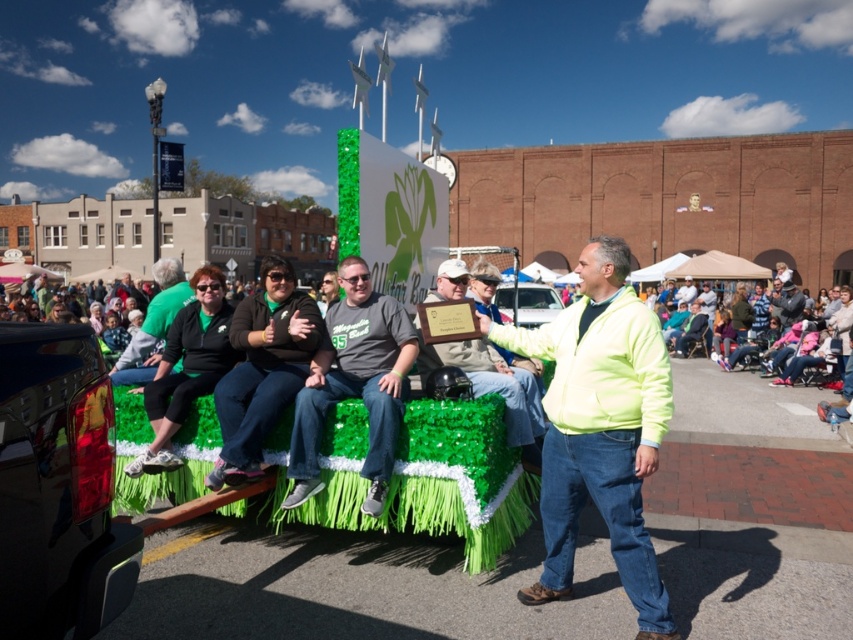
You are a photographer at the parade and want to capture both the neon yellow jacket at center and the matte gray shirt at center in a single photo. Which object should you focus on first to ensure both are in the frame?

You should focus on the neon yellow jacket at center first since it is in front of the matte gray shirt at center, ensuring both will be visible in the photo.

You are a photographer trying to capture a clear shot of both the neon yellow jacket at center and the matte green shirt at center from your position at the back of the crowd. Which clothing item will appear taller in your photo?

The neon yellow jacket at center will appear taller in the photo because it has a greater height compared to the matte green shirt at center.